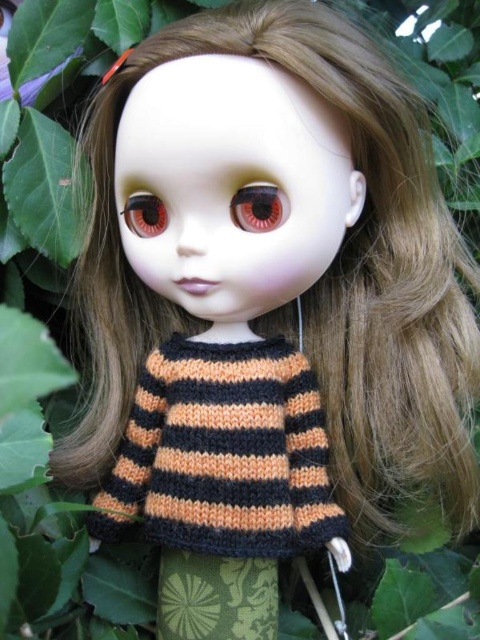
You are an artist trying to sketch the doll. You need to position the orange knitted sweater at center and the matte brown eye at center correctly. Based on the scene, which object should be drawn first if you want to follow the left to right drawing order?

The orange knitted sweater at center should be drawn first because it is positioned to the left of the matte brown eye at center, following a left to right drawing order.

In the scene shown: You are a photographer adjusting your camera to focus on the orange knitted sweater at center and the matte brown eye at center of the doll. Which object should you focus on first to ensure proper depth of field?

You should focus on the orange knitted sweater at center first because it is closer to the viewer than the matte brown eye at center, allowing for better depth of field adjustment.

You are a fashion designer observing the doll and want to adjust its outfit. Since the orange knitted sweater at center and the matte brown eye at center are both at the center, which one is positioned higher on the doll?

The orange knitted sweater at center is much taller than the matte brown eye at center, so it is positioned higher on the doll.